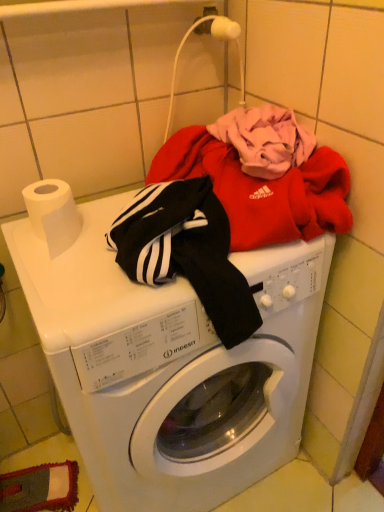
This screenshot has width=384, height=512. I want to click on free location in front of white matte toilet paper at left, so click(x=70, y=285).